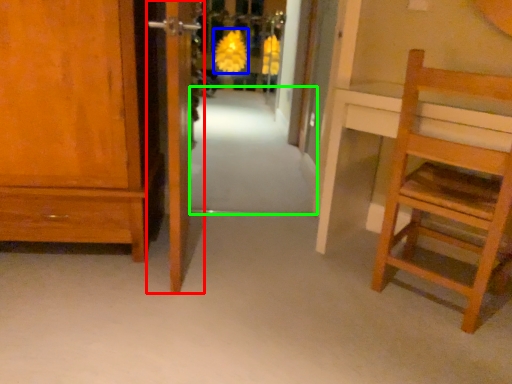
Question: Which is nearer to the door (highlighted by a red box)? flower (highlighted by a blue box) or path (highlighted by a green box).

Choices:
 (A) flower
 (B) path

Answer: (B)